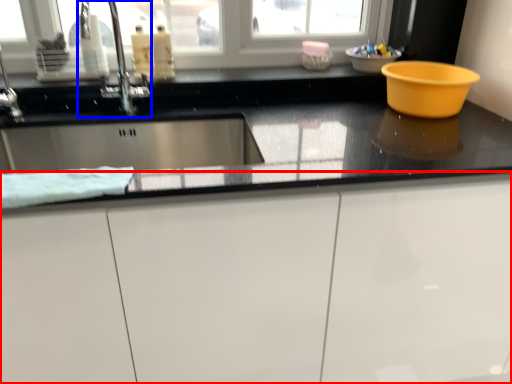
Question: Which point is further to the camera, cabinetry (highlighted by a red box) or tap (highlighted by a blue box)?

Choices:
 (A) cabinetry
 (B) tap

Answer: (B)